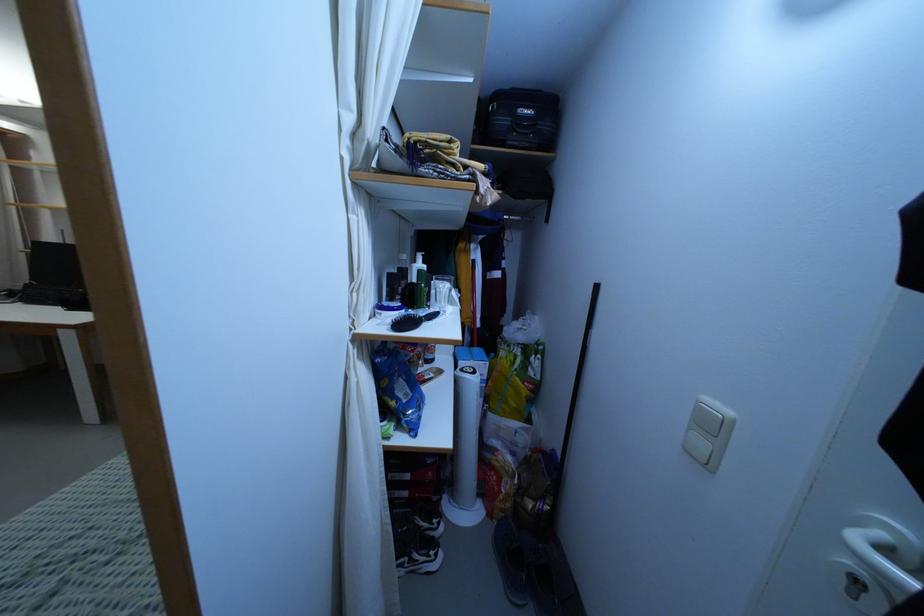
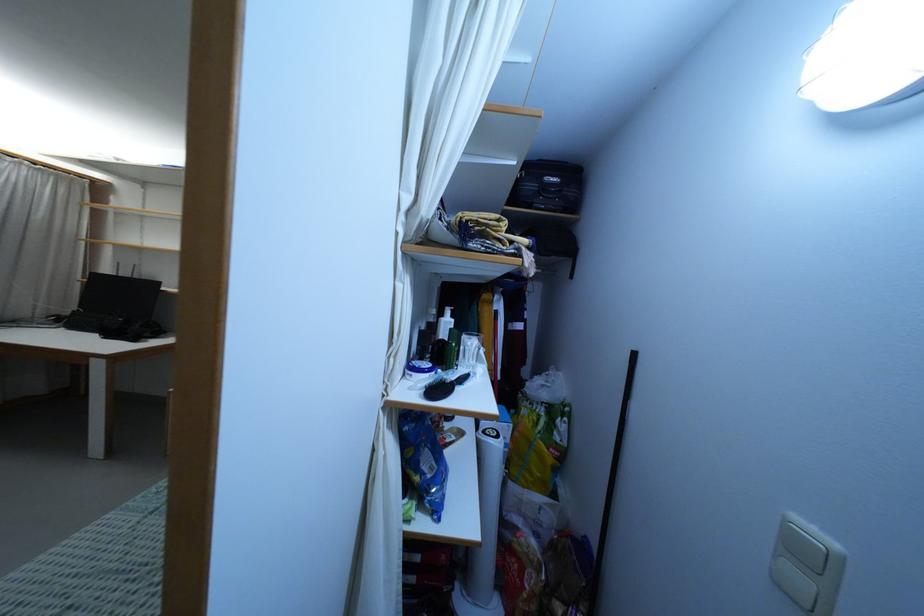
The point at (701,444) is marked in the first image. Where is the corresponding point in the second image?

(799, 580)